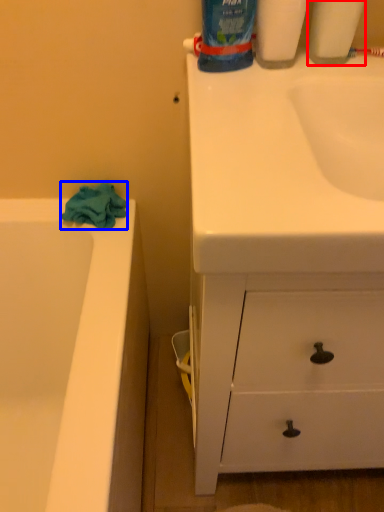
Question: Which point is further to the camera, cleaning product (highlighted by a red box) or bath towel (highlighted by a blue box)?

Choices:
 (A) cleaning product
 (B) bath towel

Answer: (B)